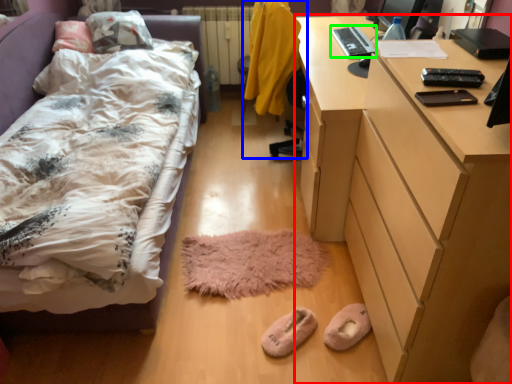
Question: Estimate the real-world distances between objects in this image. Which object is closer to desk (highlighted by a red box), swivel chair (highlighted by a blue box) or laptop (highlighted by a green box)?

Choices:
 (A) swivel chair
 (B) laptop

Answer: (A)